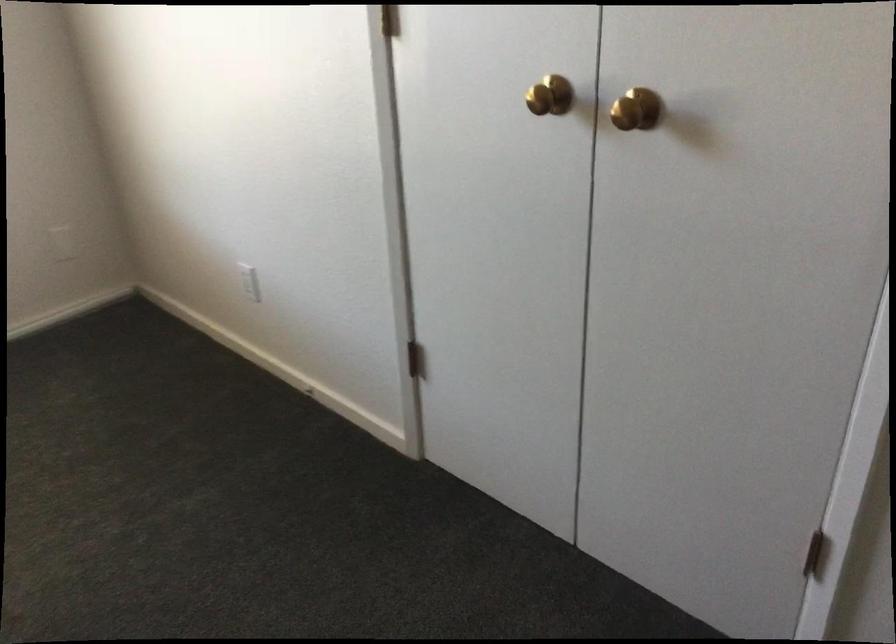
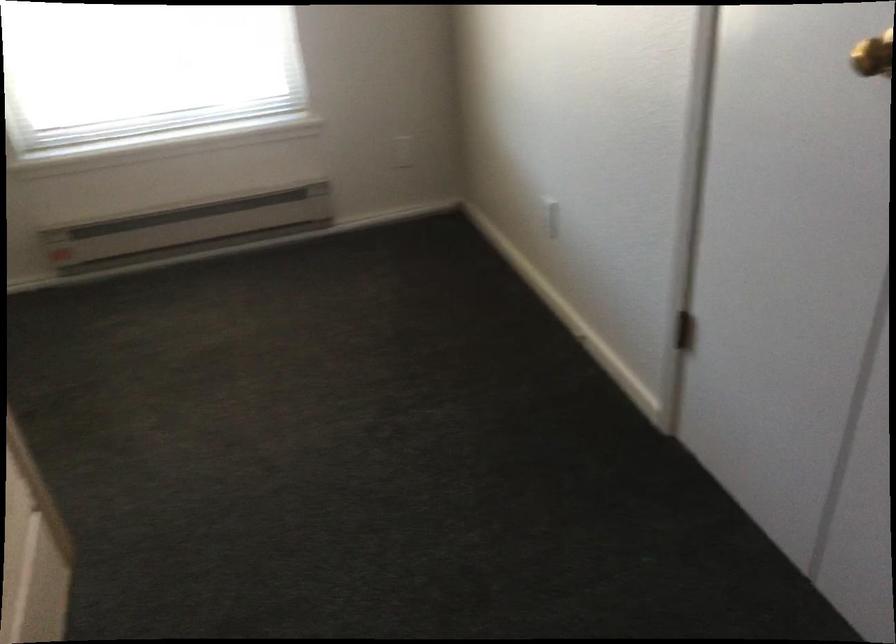
Question: The camera is either moving clockwise (left) or counter-clockwise (right) around the object. The first image is from the beginning of the video and the second image is from the end. Is the camera moving left or right when shooting the video?

Choices:
 (A) Left
 (B) Right

Answer: (B)